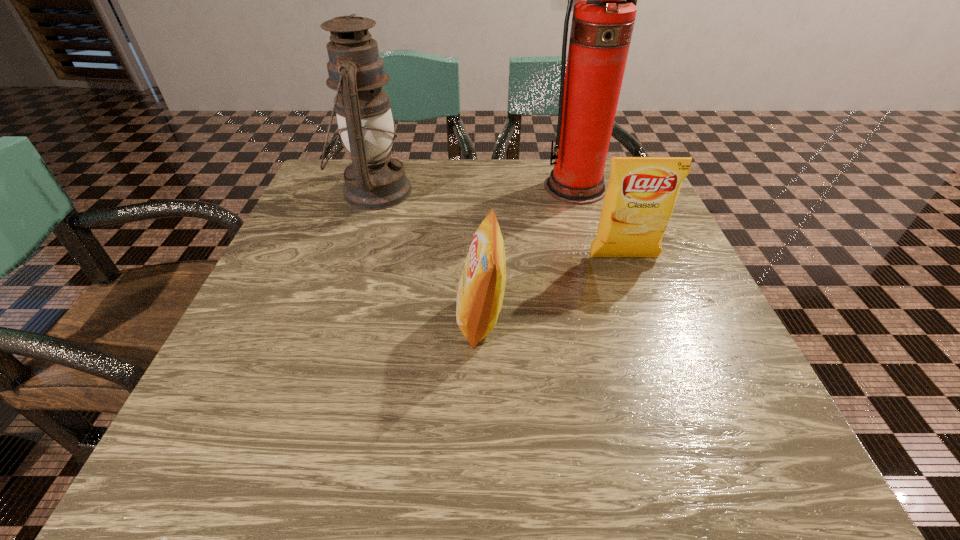
Where is `free region located on the front-facing side of the nearer crisp (potato chip)`? This screenshot has width=960, height=540. free region located on the front-facing side of the nearer crisp (potato chip) is located at coordinates tap(261, 318).

Find the location of a particular element. Image resolution: width=960 pixels, height=540 pixels. vacant space located 0.160m on the front-facing side of the nearer crisp (potato chip) is located at coordinates (365, 318).

This screenshot has height=540, width=960. In order to click on vacant space located on the front-facing side of the nearer crisp (potato chip) in this screenshot , I will do `click(399, 318)`.

The width and height of the screenshot is (960, 540). What are the coordinates of `fire extinguisher situated at the far edge` in the screenshot? It's located at (603, 19).

Image resolution: width=960 pixels, height=540 pixels. Identify the location of oil lamp present at the far edge. (373, 181).

The image size is (960, 540). What are the coordinates of `object that is at the left edge` in the screenshot? It's located at (373, 181).

Where is `fire extinguisher located at the right edge`? Image resolution: width=960 pixels, height=540 pixels. fire extinguisher located at the right edge is located at coordinates (603, 19).

Locate an element on the screen. This screenshot has height=540, width=960. crisp (potato chip) that is at the right edge is located at coordinates (642, 191).

Identify the location of object located at the far left corner. This screenshot has height=540, width=960. (373, 181).

Find the location of a particular element. The height and width of the screenshot is (540, 960). object at the far right corner is located at coordinates (603, 19).